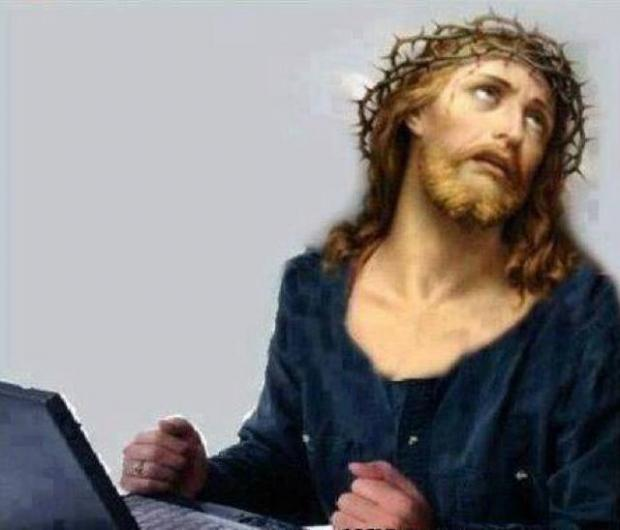
At what (x,y) coordinates should I click in order to perform the action: click on laptop computer. Please return your answer as a coordinate pair (x, y). The image size is (620, 530). Looking at the image, I should click on (86, 463), (180, 517).